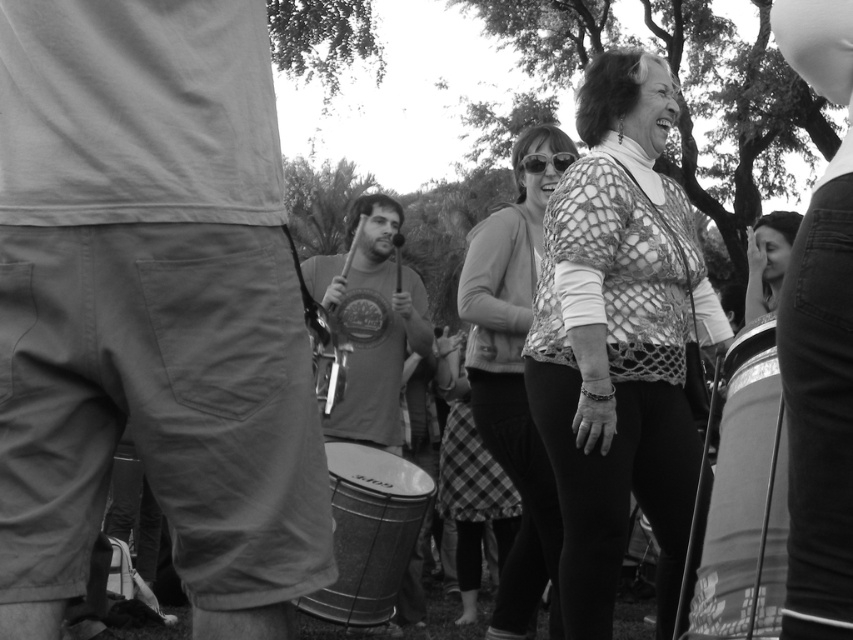
You are a photographer standing in the park and want to take a closeup shot of the metallic drum at right and the smooth drum at center. Which drum should you move closer to if you want to capture both in focus without changing your position?

You should move closer to the metallic drum at right because it is nearer to you than the smooth drum at center, so adjusting your position towards it would help both drums stay in focus.

You are standing at the point with coordinates point [113,60] and want to walk to point [567,554]. Given that you can only move forward in a straight line, will you be able to reach the destination without any obstacles?

Point [113,60] is closer to the viewer than point [567,554], so you will have to walk away from your current position towards the background to reach the destination. Since there are no obstacles mentioned, you can reach it by moving straight ahead.

You are a photographer standing at the edge of the scene. You want to take a photo that includes both the khaki cotton shorts at left and the crochet sweater at center. Given that your camera has a maximum focus range of 1.5 meters, will you be able to capture both subjects in focus without moving?

The distance between the khaki cotton shorts at left and the crochet sweater at center is 1.77 meters. Since your camera can only focus within 1.5 meters, the two subjects are too far apart to be in focus simultaneously. You will need to adjust your position or use a different camera setting.